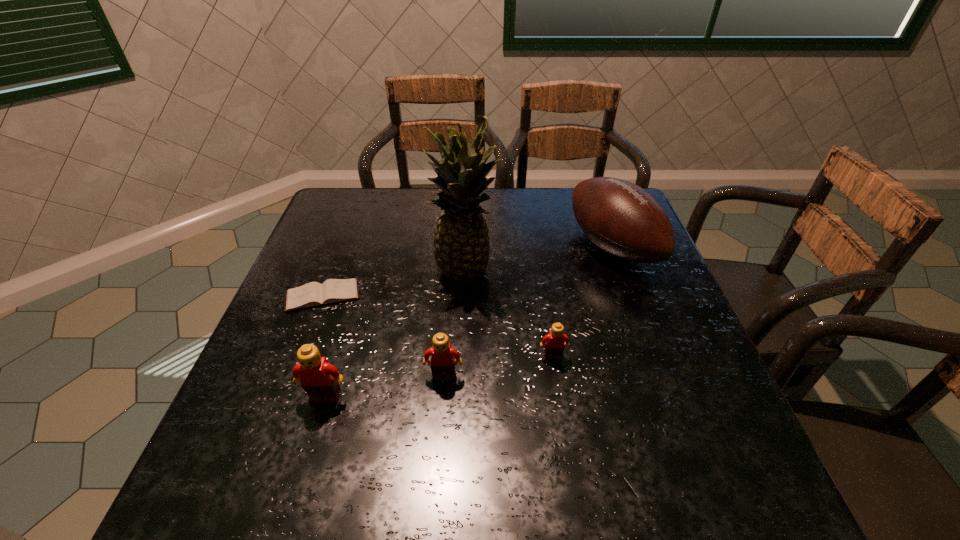
Locate which Lego ranks in proximity to the second shortest object. Please provide its 2D coordinates. Your answer should be formatted as a tuple, i.e. [(x, y)], where the tuple contains the x and y coordinates of a point satisfying the conditions above.

[(442, 354)]